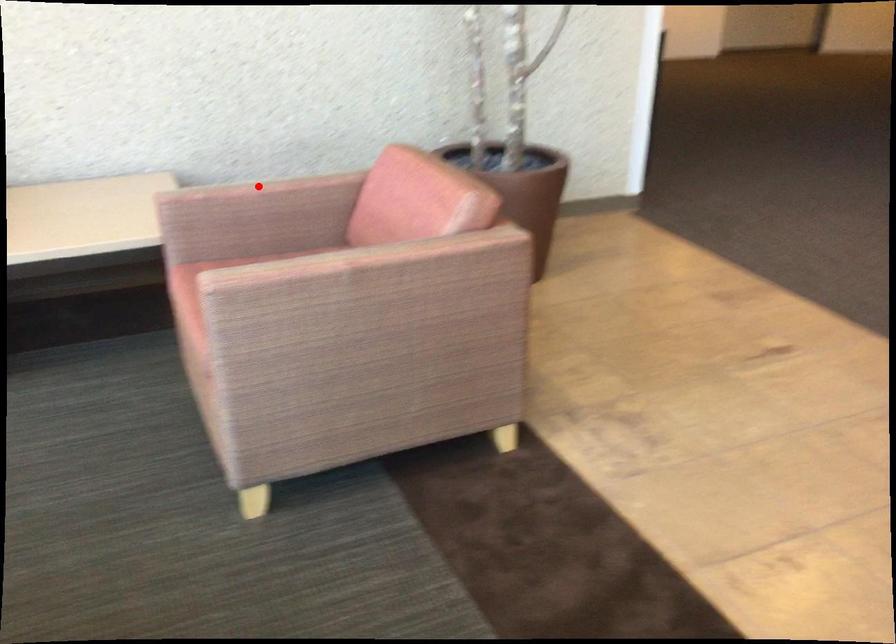
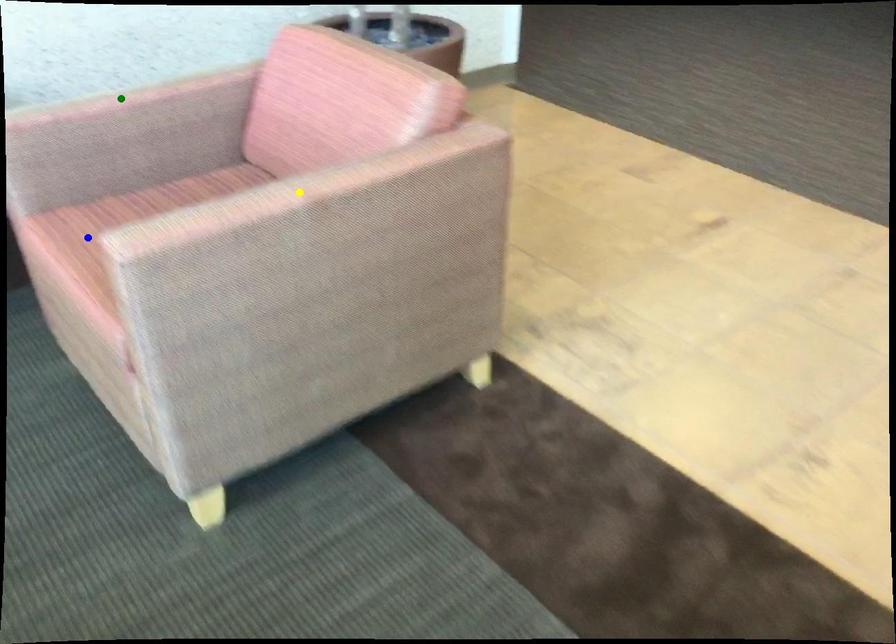
Question: I am providing you with two images of the same scene from different viewpoints. A red point is marked on the first image. You are given multiple points on the second image. Which point in image 2 represents the same 3d spot as the red point in image 1?

Choices:
 (A) yellow point
 (B) green point
 (C) blue point

Answer: (B)